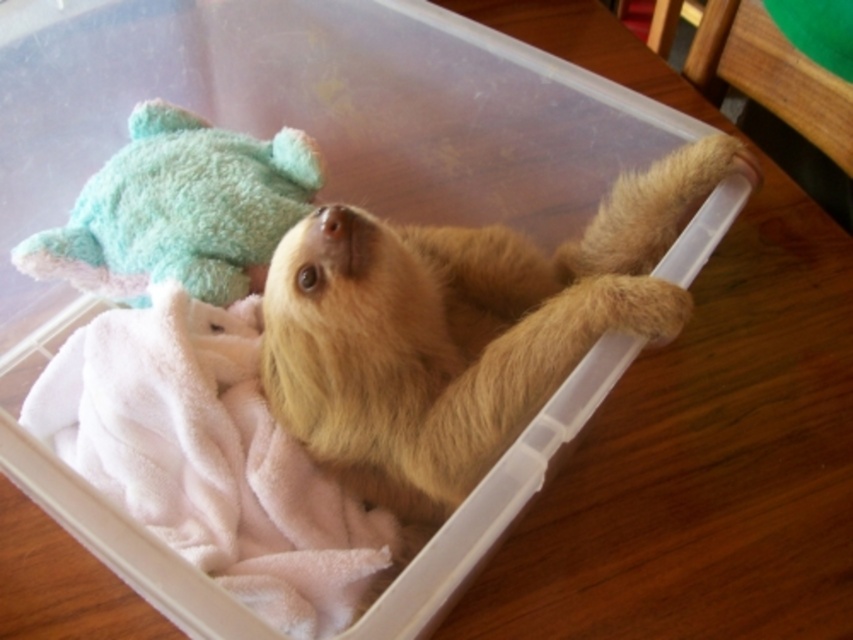
Question: Does fuzzy golden sloth at center come behind teal plush toy at upper left?

Choices:
 (A) no
 (B) yes

Answer: (A)

Question: Is fuzzy golden sloth at center positioned before teal plush toy at upper left?

Choices:
 (A) yes
 (B) no

Answer: (A)

Question: Does fuzzy golden sloth at center lie in front of teal plush toy at upper left?

Choices:
 (A) no
 (B) yes

Answer: (B)